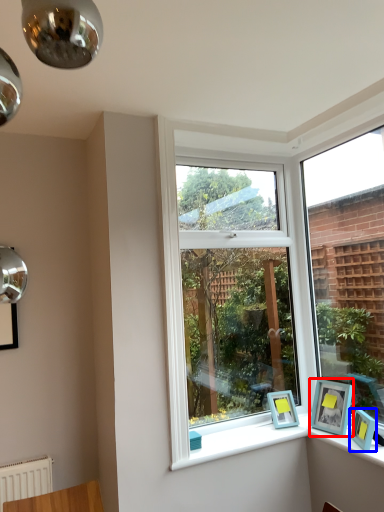
Question: Which point is closer to the camera, picture frame (highlighted by a red box) or picture frame (highlighted by a blue box)?

Choices:
 (A) picture frame
 (B) picture frame

Answer: (B)